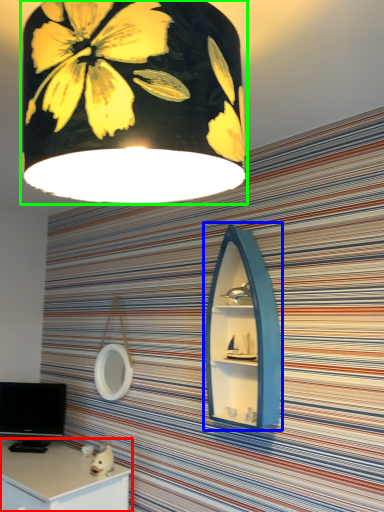
Question: Which object is the closest to the desk (highlighted by a red box)? Choose among these: medicine cabinet (highlighted by a blue box) or lamp (highlighted by a green box).

Choices:
 (A) medicine cabinet
 (B) lamp

Answer: (A)